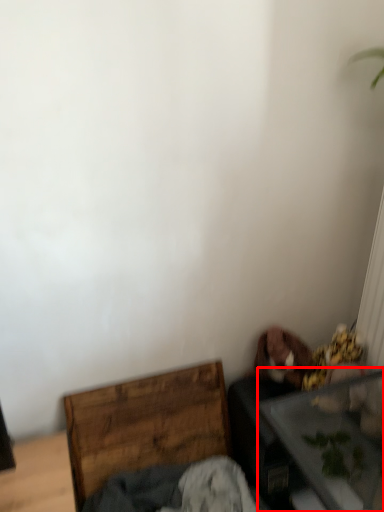
Question: Considering the relative positions of table (annotated by the red box) and furniture in the image provided, where is table (annotated by the red box) located with respect to the staircase?

Choices:
 (A) left
 (B) right

Answer: (B)